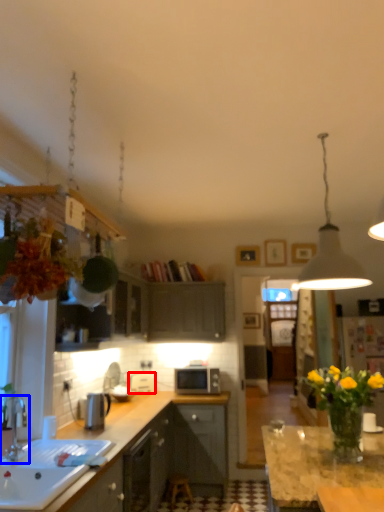
Question: Which of the following is the farthest to the observer, appliance (highlighted by a red box) or tap (highlighted by a blue box)?

Choices:
 (A) appliance
 (B) tap

Answer: (A)